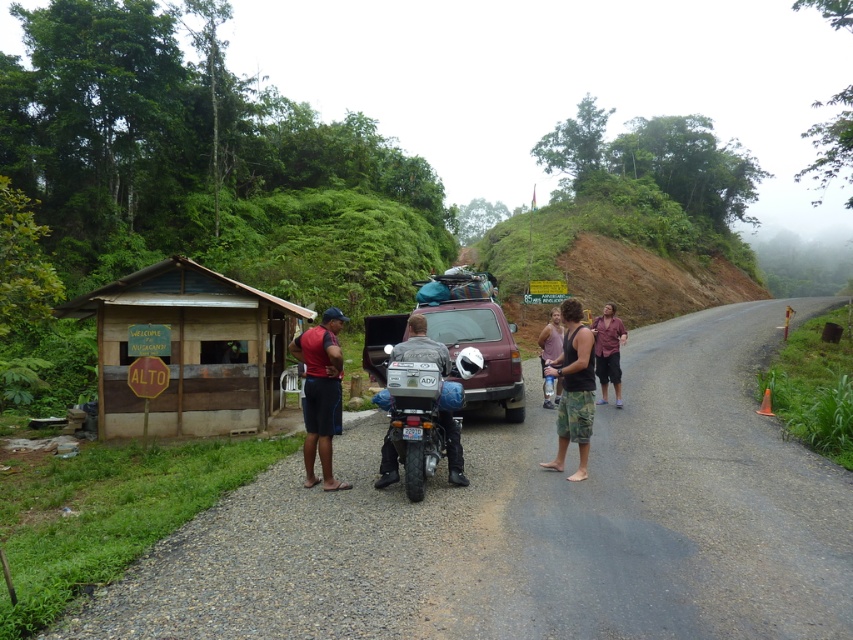
Is point (170, 340) more distant than point (566, 353)?

Yes, point (170, 340) is behind point (566, 353).

Is wooden hut at left bigger than camouflage shorts at right?

Indeed, wooden hut at left has a larger size compared to camouflage shorts at right.

This screenshot has width=853, height=640. I want to click on wooden hut at left, so click(189, 349).

At what (x,y) coordinates should I click in order to perform the action: click on wooden hut at left. Please return your answer as a coordinate pair (x, y). This screenshot has width=853, height=640. Looking at the image, I should click on (189, 349).

Between gravel road at center and camouflage shorts at right, which one has less height?

camouflage shorts at right

Identify the location of gravel road at center. (534, 525).

Describe the element at coordinates (418, 417) in the screenshot. This screenshot has height=640, width=853. I see `matte black motorcycle at center` at that location.

Which is in front, point (405, 356) or point (337, 380)?

Point (405, 356) is in front.

Is point (444, 435) more distant than point (306, 456)?

No, (444, 435) is in front of (306, 456).

This screenshot has height=640, width=853. Identify the location of matte black motorcycle at center. (418, 417).